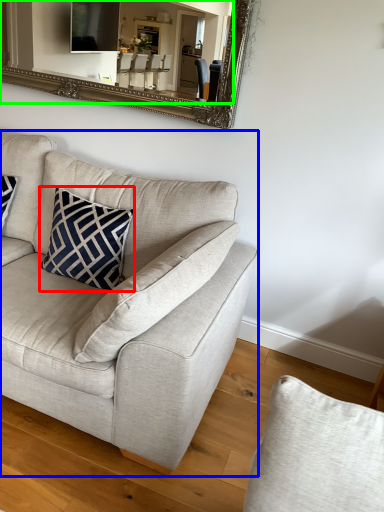
Question: Which is nearer to the pillow (highlighted by a red box)? studio couch (highlighted by a blue box) or mirror (highlighted by a green box).

Choices:
 (A) studio couch
 (B) mirror

Answer: (A)